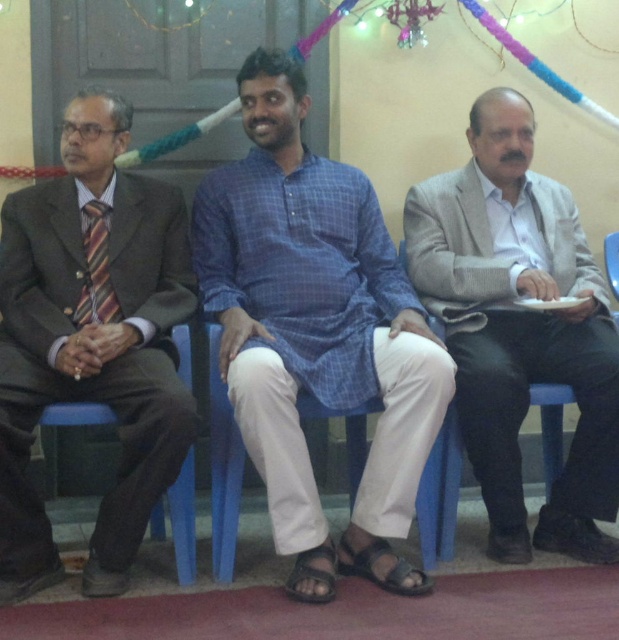
You are planning to place a decorative wreath on the wall behind the gray woolen suit at right and the blue plastic chair at center. Based on their positions, which object is closer to the wall where you want to hang the wreath?

The gray woolen suit at right is closer to the wall because the blue plastic chair at center is behind it, meaning the suit is positioned nearer to the wall.